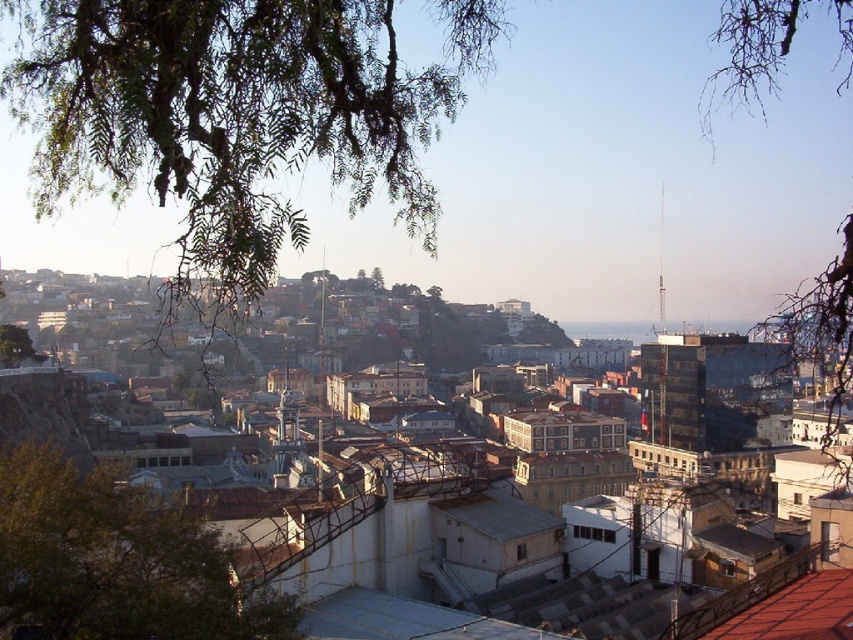
Can you confirm if green leafy tree at lower left is positioned above green leafy tree at upper left?

Actually, green leafy tree at lower left is below green leafy tree at upper left.

Does green leafy tree at lower left appear on the right side of green leafy tree at upper left?

Indeed, green leafy tree at lower left is positioned on the right side of green leafy tree at upper left.

Who is more forward, (187,550) or (39,362)?

Point (187,550)

Find the location of a particular element. Image resolution: width=853 pixels, height=640 pixels. green leafy tree at lower left is located at coordinates (113, 563).

Between green leafy branches at upper left and green leafy tree at upper left, which one has more height?

With more height is green leafy branches at upper left.

Is green leafy branches at upper left to the left of green leafy tree at upper left from the viewer's perspective?

In fact, green leafy branches at upper left is to the right of green leafy tree at upper left.

Measure the distance between green leafy branches at upper left and camera.

36.43 meters

Locate an element on the screen. green leafy branches at upper left is located at coordinates (235, 113).

How far apart are bare branches at upper left and green leafy tree at upper left?

The distance of bare branches at upper left from green leafy tree at upper left is 257.92 meters.

Is bare branches at upper left below green leafy tree at upper left?

No.

Is point (817, 300) farther from camera compared to point (0, 324)?

No, (817, 300) is in front of (0, 324).

Find the location of `bare branches at upper left`. bare branches at upper left is located at coordinates (766, 45).